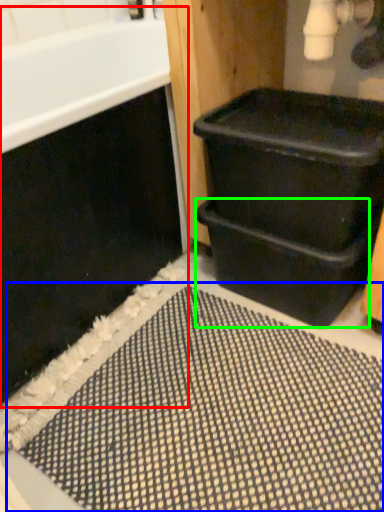
Question: Which object is the closest to the bath (highlighted by a red box)? Choose among these: bath mat (highlighted by a blue box) or drawer (highlighted by a green box).

Choices:
 (A) bath mat
 (B) drawer

Answer: (B)